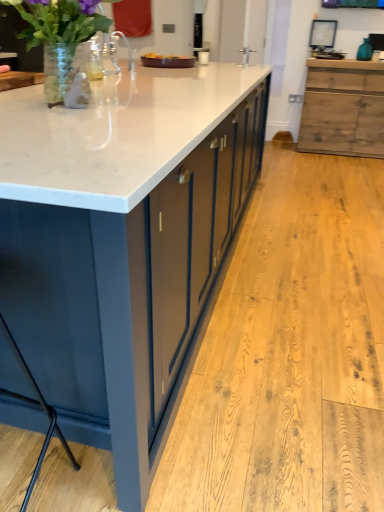
In order to face clear glass vase at upper left, should I rotate leftwards or rightwards?

Rotate left and turn 16.231 degrees.

The image size is (384, 512). In order to click on clear glass vase at upper left in this screenshot , I will do `click(62, 42)`.

You are a GUI agent. You are given a task and a screenshot of the screen. Output one action in this format:
    pyautogui.click(x=<x>, y=<y>)
    Task: Click on the white marble countertop at center
    This screenshot has height=512, width=384.
    Given the screenshot: What is the action you would take?
    pyautogui.click(x=122, y=246)

Describe the element at coordinates (37, 407) in the screenshot. This screenshot has height=512, width=384. I see `matte dark blue bar stool at lower left` at that location.

Describe the element at coordinates (343, 108) in the screenshot. The image size is (384, 512). I see `rustic wood cabinet at right` at that location.

Identify the location of clear glass vase at upper left. (62, 42).

Can you confirm if matte dark blue bar stool at lower left is taller than clear glass vase at upper left?

Indeed, matte dark blue bar stool at lower left has a greater height compared to clear glass vase at upper left.

Which is nearer, (33, 404) or (77, 52)?

Clearly, point (33, 404) is closer to the camera than point (77, 52).

Is matte dark blue bar stool at lower left outside of clear glass vase at upper left?

Yes.

Is the surface of matte dark blue bar stool at lower left in direct contact with clear glass vase at upper left?

No, matte dark blue bar stool at lower left is not beside clear glass vase at upper left.

Is clear glass vase at upper left inside the boundaries of matte dark blue bar stool at lower left, or outside?

clear glass vase at upper left cannot be found inside matte dark blue bar stool at lower left.

Between clear glass vase at upper left and matte dark blue bar stool at lower left, which one is positioned behind?

clear glass vase at upper left is behind.

Is point (37, 30) positioned behind point (4, 322)?

Yes, point (37, 30) is farther from viewer.

Can matte dark blue bar stool at lower left be found inside rustic wood cabinet at right?

No, matte dark blue bar stool at lower left is not inside rustic wood cabinet at right.

From a real-world perspective, between rustic wood cabinet at right and matte dark blue bar stool at lower left, who is vertically lower?

matte dark blue bar stool at lower left is physically lower.

Are rustic wood cabinet at right and matte dark blue bar stool at lower left beside each other?

rustic wood cabinet at right and matte dark blue bar stool at lower left are clearly separated.

Is rustic wood cabinet at right taller or shorter than matte dark blue bar stool at lower left?

Clearly, rustic wood cabinet at right is taller compared to matte dark blue bar stool at lower left.

Is matte dark blue bar stool at lower left looking in the opposite direction of rustic wood cabinet at right?

matte dark blue bar stool at lower left does not have its back to rustic wood cabinet at right.

Considering the sizes of matte dark blue bar stool at lower left and rustic wood cabinet at right in the image, is matte dark blue bar stool at lower left taller or shorter than rustic wood cabinet at right?

Clearly, matte dark blue bar stool at lower left is shorter compared to rustic wood cabinet at right.

From the image's perspective, would you say matte dark blue bar stool at lower left is shown under rustic wood cabinet at right?

Indeed, from the image's perspective, matte dark blue bar stool at lower left is shown beneath rustic wood cabinet at right.

Is matte dark blue bar stool at lower left not within rustic wood cabinet at right?

Yes.

From the image's perspective, which is above, matte dark blue bar stool at lower left or white marble countertop at center?

white marble countertop at center is shown above in the image.

Considering the sizes of matte dark blue bar stool at lower left and white marble countertop at center in the image, is matte dark blue bar stool at lower left bigger or smaller than white marble countertop at center?

Considering their sizes, matte dark blue bar stool at lower left takes up less space than white marble countertop at center.

Which is closer to the camera, (3,324) or (89,131)?

Point (3,324) is farther from the camera than point (89,131).

Is matte dark blue bar stool at lower left shorter than white marble countertop at center?

Yes.

From a real-world perspective, is clear glass vase at upper left positioned above or below white marble countertop at center?

clear glass vase at upper left is above white marble countertop at center.

Can you confirm if clear glass vase at upper left is shorter than white marble countertop at center?

Yes, clear glass vase at upper left is shorter than white marble countertop at center.

From the image's perspective, who appears lower, clear glass vase at upper left or white marble countertop at center?

white marble countertop at center appears lower in the image.

How much distance is there between clear glass vase at upper left and white marble countertop at center?

A distance of 22.53 inches exists between clear glass vase at upper left and white marble countertop at center.

Considering the sizes of objects rustic wood cabinet at right and clear glass vase at upper left in the image provided, who is wider, rustic wood cabinet at right or clear glass vase at upper left?

Wider between the two is rustic wood cabinet at right.

Considering the relative positions of rustic wood cabinet at right and clear glass vase at upper left in the image provided, is rustic wood cabinet at right to the left or to the right of clear glass vase at upper left?

Based on their positions, rustic wood cabinet at right is located to the right of clear glass vase at upper left.

Considering the relative sizes of rustic wood cabinet at right and clear glass vase at upper left in the image provided, is rustic wood cabinet at right smaller than clear glass vase at upper left?

No, rustic wood cabinet at right is not smaller than clear glass vase at upper left.

Where is `houseplant that is above the matte dark blue bar stool at lower left (from a real-world perspective)`? This screenshot has height=512, width=384. houseplant that is above the matte dark blue bar stool at lower left (from a real-world perspective) is located at coordinates (62, 42).

This screenshot has width=384, height=512. I want to click on houseplant above the matte dark blue bar stool at lower left (from the image's perspective), so click(x=62, y=42).

Based on the photo, when comparing their distances from white marble countertop at center, does matte dark blue bar stool at lower left or rustic wood cabinet at right seem further?

Among the two, rustic wood cabinet at right is located further to white marble countertop at center.

Estimate the real-world distances between objects in this image. Which object is further from white marble countertop at center, matte dark blue bar stool at lower left or clear glass vase at upper left?

matte dark blue bar stool at lower left is positioned further to the anchor white marble countertop at center.

Based on their spatial positions, is clear glass vase at upper left or matte dark blue bar stool at lower left closer to rustic wood cabinet at right?

Based on the image, clear glass vase at upper left appears to be nearer to rustic wood cabinet at right.

Estimate the real-world distances between objects in this image. Which object is further from rustic wood cabinet at right, clear glass vase at upper left or white marble countertop at center?

Based on the image, clear glass vase at upper left appears to be further to rustic wood cabinet at right.

Looking at the image, which one is located further to rustic wood cabinet at right, matte dark blue bar stool at lower left or white marble countertop at center?

Among the two, matte dark blue bar stool at lower left is located further to rustic wood cabinet at right.

From the picture: Looking at the image, which one is located closer to white marble countertop at center, clear glass vase at upper left or rustic wood cabinet at right?

Based on the image, clear glass vase at upper left appears to be nearer to white marble countertop at center.

When comparing their distances from white marble countertop at center, does rustic wood cabinet at right or matte dark blue bar stool at lower left seem closer?

matte dark blue bar stool at lower left is positioned closer to the anchor white marble countertop at center.

Which object lies nearer to the anchor point matte dark blue bar stool at lower left, clear glass vase at upper left or white marble countertop at center?

white marble countertop at center.

Where is `houseplant between white marble countertop at center and rustic wood cabinet at right from front to back`? houseplant between white marble countertop at center and rustic wood cabinet at right from front to back is located at coordinates (62, 42).

This screenshot has height=512, width=384. I want to click on countertop between clear glass vase at upper left and matte dark blue bar stool at lower left in the vertical direction, so click(122, 246).

At what (x,y) coordinates should I click in order to perform the action: click on houseplant between matte dark blue bar stool at lower left and rustic wood cabinet at right from front to back. Please return your answer as a coordinate pair (x, y). The height and width of the screenshot is (512, 384). Looking at the image, I should click on pyautogui.click(x=62, y=42).

This screenshot has width=384, height=512. I want to click on countertop between matte dark blue bar stool at lower left and rustic wood cabinet at right from front to back, so click(122, 246).